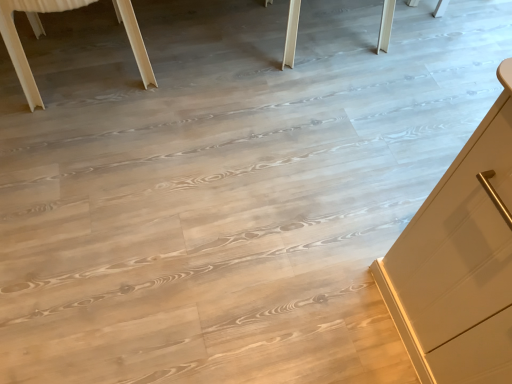
Question: Considering the relative sizes of light wood table at upper left and natural wood table at upper center in the image provided, is light wood table at upper left bigger than natural wood table at upper center?

Choices:
 (A) yes
 (B) no

Answer: (B)

Question: Is light wood table at upper left with natural wood table at upper center?

Choices:
 (A) yes
 (B) no

Answer: (A)

Question: From the image's perspective, is light wood table at upper left below natural wood table at upper center?

Choices:
 (A) no
 (B) yes

Answer: (B)

Question: Does light wood table at upper left have a lesser width compared to natural wood table at upper center?

Choices:
 (A) yes
 (B) no

Answer: (A)

Question: Can you confirm if light wood table at upper left is taller than natural wood table at upper center?

Choices:
 (A) no
 (B) yes

Answer: (B)

Question: Is light wood table at upper left positioned with its back to natural wood table at upper center?

Choices:
 (A) no
 (B) yes

Answer: (B)

Question: Is light wood table at upper left at the back of natural wood table at upper center?

Choices:
 (A) yes
 (B) no

Answer: (A)

Question: From the image's perspective, is natural wood table at upper center below light wood table at upper left?

Choices:
 (A) no
 (B) yes

Answer: (A)

Question: From the image's perspective, would you say natural wood table at upper center is positioned over light wood table at upper left?

Choices:
 (A) yes
 (B) no

Answer: (A)

Question: Is light wood table at upper left a part of natural wood table at upper center?

Choices:
 (A) no
 (B) yes

Answer: (B)

Question: From a real-world perspective, is natural wood table at upper center positioned under light wood table at upper left based on gravity?

Choices:
 (A) no
 (B) yes

Answer: (B)

Question: Is natural wood table at upper center closer to camera compared to light wood table at upper left?

Choices:
 (A) yes
 (B) no

Answer: (B)

Question: From a real-world perspective, is light wood table at upper left positioned above or below natural wood table at upper center?

Choices:
 (A) above
 (B) below

Answer: (A)